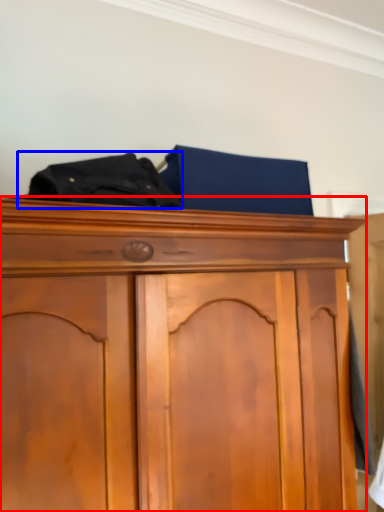
Question: Which of the following is the farthest to the observer, cupboard (highlighted by a red box) or underclothes (highlighted by a blue box)?

Choices:
 (A) cupboard
 (B) underclothes

Answer: (B)